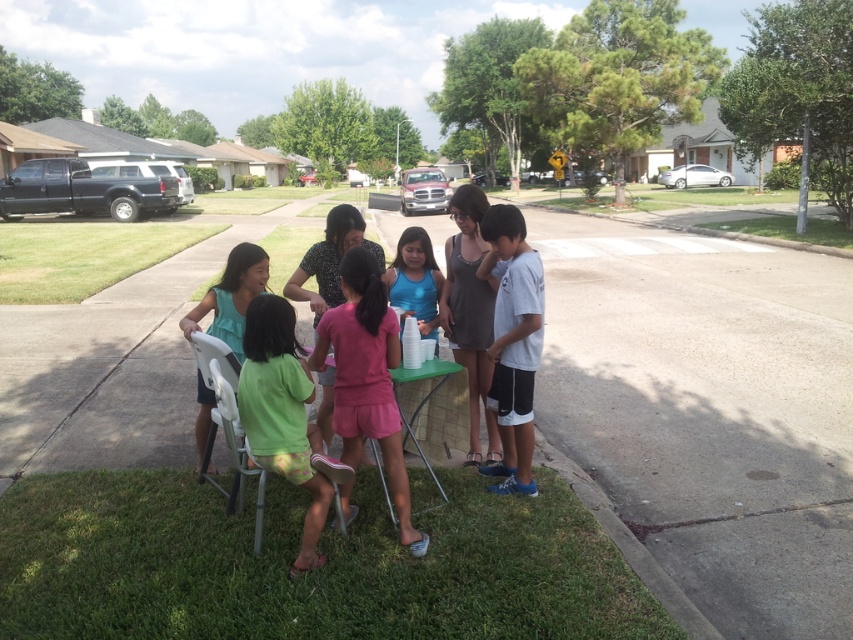
You are standing at the point labeled point (523,227) and want to walk to the point labeled point (444,305). Which direction should you face to walk directly towards your destination?

Since point (523,227) is closer to the camera than point (444,305), you should face away from the camera to walk directly towards point (444,305).

You are standing at the point labeled point (332,310) and want to walk to the point labeled point (778,600). Which direction should you move in?

You should move forward towards the point labeled point (778,600) because it is in front of point (332,310).